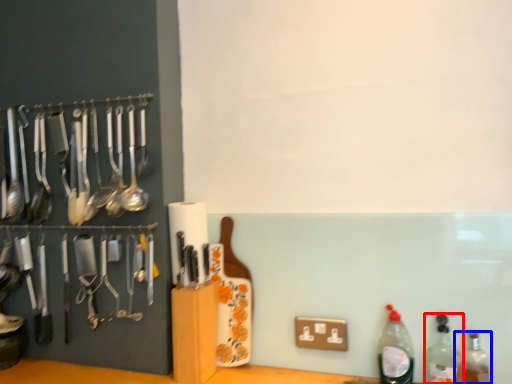
Question: Which object is closer to the camera taking this photo, bottle (highlighted by a red box) or bottle (highlighted by a blue box)?

Choices:
 (A) bottle
 (B) bottle

Answer: (B)